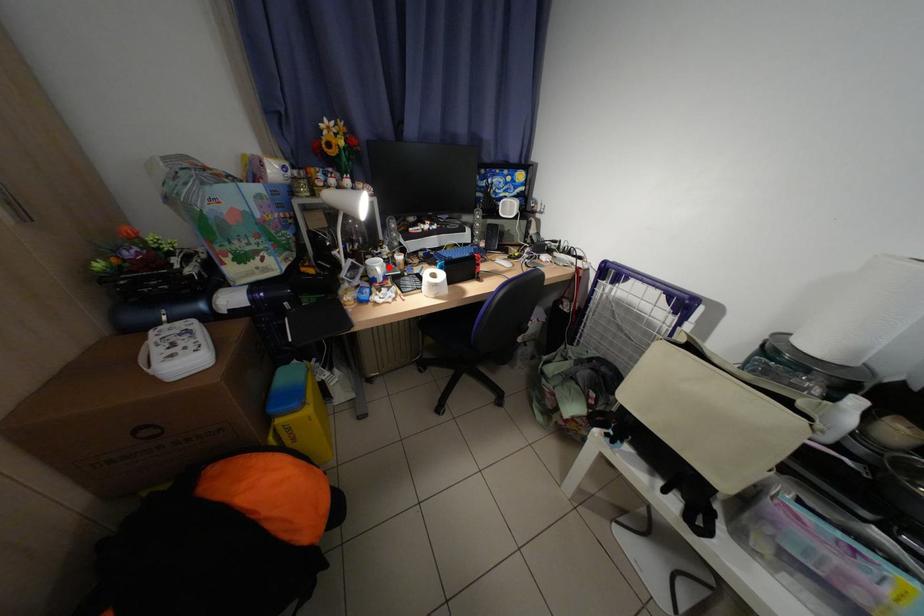
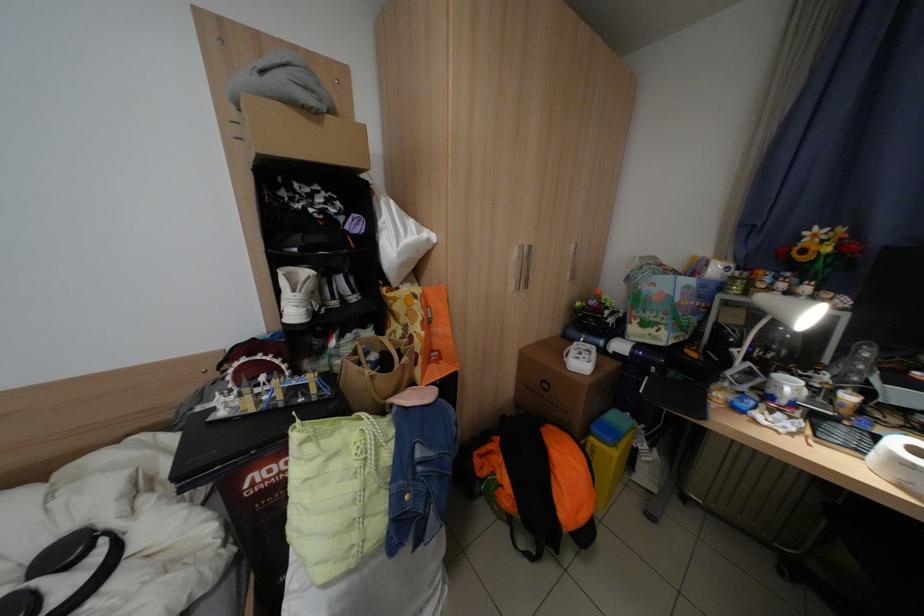
Find the pixel in the second image that matches the highlighted location in the first image.

(800, 387)